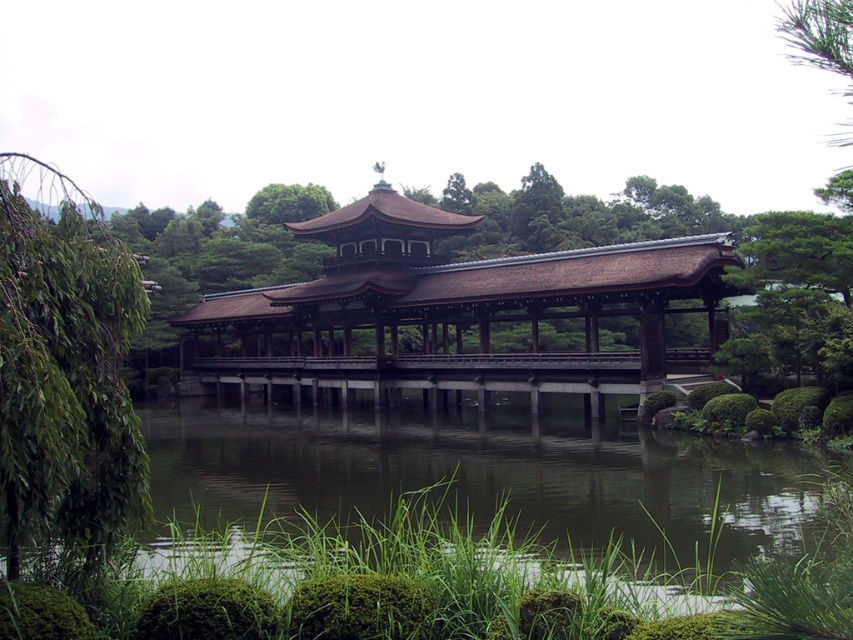
You are a visitor standing at the entrance of the garden and want to take a photo of both the green leafy tree at left and the brown wooden bridge at center. Which object should you position closer to the front of your camera frame to include both in the photo?

The green leafy tree at left is closer to the viewer than the brown wooden bridge at center, so you should position the green leafy tree at left closer to the front of your camera frame to include both in the photo.

You are a visitor in the Japanese garden and want to take a photo of the green leafy tree at left and the brown wooden bridge at center. Which object will appear smaller in the photo?

The green leafy tree at left will appear smaller in the photo because it is smaller than the brown wooden bridge at center.